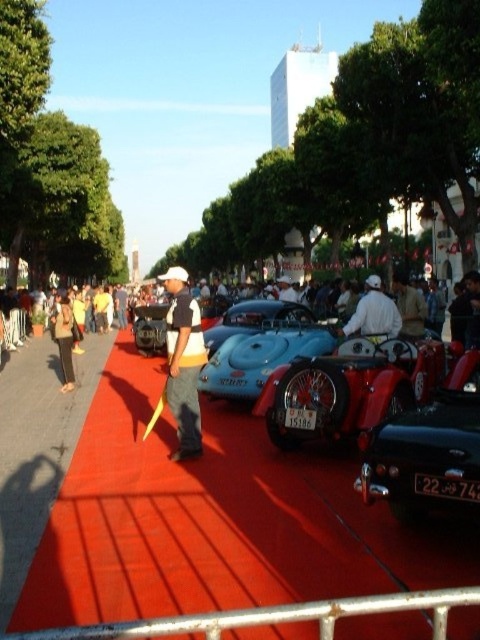
You are a photographer standing at the edge of the red carpet. You want to take a photo of the blue glossy car at center and the dark brown pants at left in the same frame. Given that your camera has a maximum focus range of 4 meters, will both subjects be in focus?

The blue glossy car at center and dark brown pants at left are 4.28 meters apart from each other. Since the distance between them exceeds the camera focus range of 4 meters, both subjects cannot be in focus simultaneously.

You are a photographer at the car show and want to capture a photo that includes both the blue glossy car at center and the white cotton shirt at center. Based on their positions, which object should you position on the left side of the frame to ensure both are included?

The blue glossy car at center is to the left of the white cotton shirt at center, so you should position the blue glossy car at center on the left side of the frame to include both in the photo.